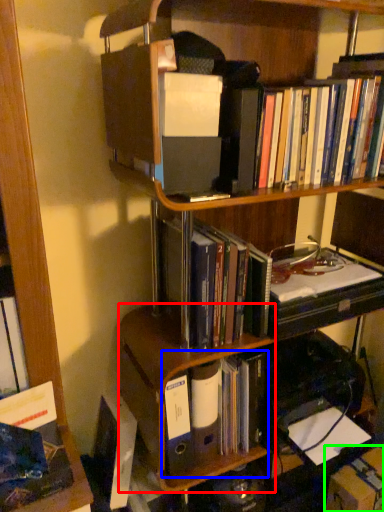
Question: Which object is the farthest from shelf (highlighted by a red box)? Choose among these: book (highlighted by a blue box) or cardboard box (highlighted by a green box).

Choices:
 (A) book
 (B) cardboard box

Answer: (B)